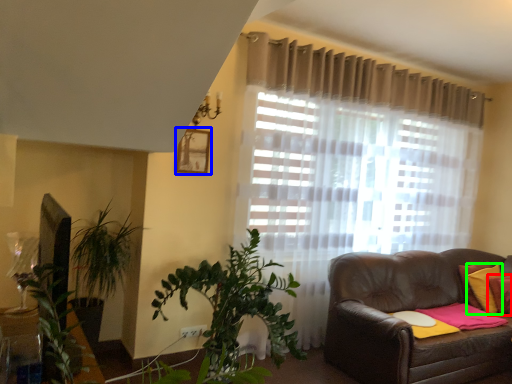
Question: Estimate the real-world distances between objects in this image. Which object is closer to pillow (highlighted by a red box), picture frame (highlighted by a blue box) or pillow (highlighted by a green box)?

Choices:
 (A) picture frame
 (B) pillow

Answer: (B)